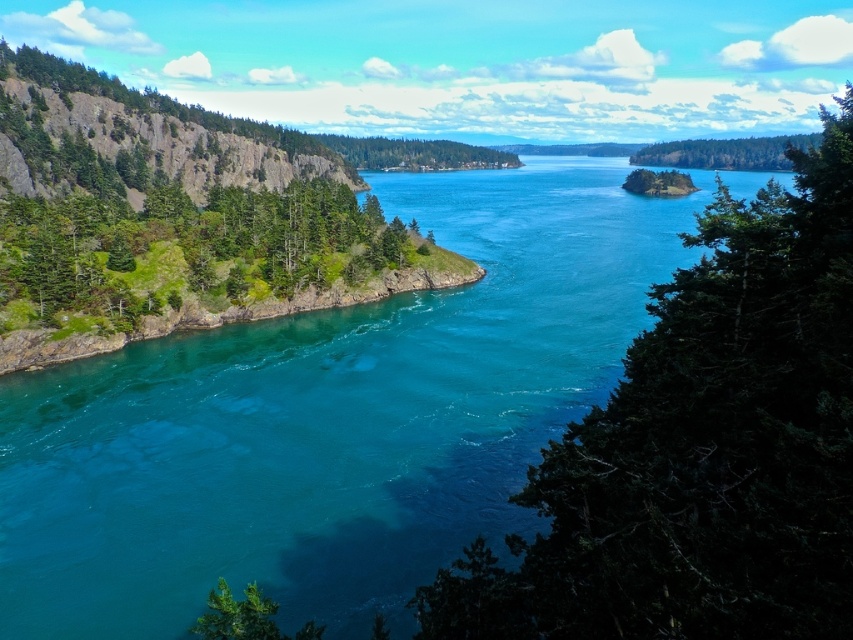
Can you confirm if clear blue water at center is positioned to the left of green leafy tree at upper right?

Indeed, clear blue water at center is positioned on the left side of green leafy tree at upper right.

In order to click on clear blue water at center in this screenshot , I will do `click(334, 419)`.

Does clear blue water at center have a smaller size compared to green textured tree at center right?

No.

Which is more to the left, clear blue water at center or green textured tree at center right?

clear blue water at center

Which is in front, point (108, 625) or point (683, 429)?

Positioned in front is point (683, 429).

Identify the location of clear blue water at center. (334, 419).

Is point (816, 348) farther from camera compared to point (750, 154)?

No, it is not.

Who is higher up, green textured tree at center right or green leafy tree at upper right?

green leafy tree at upper right is above.

What do you see at coordinates (701, 449) in the screenshot? This screenshot has width=853, height=640. I see `green textured tree at center right` at bounding box center [701, 449].

Where is `green textured tree at center right`? green textured tree at center right is located at coordinates (701, 449).